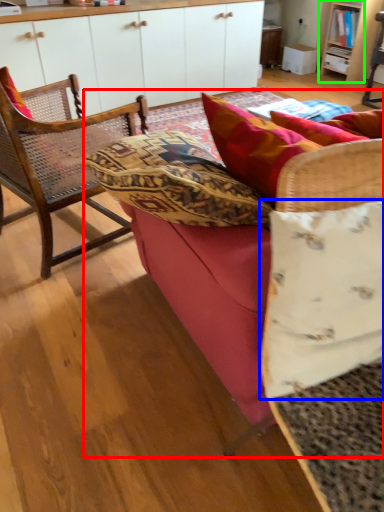
Question: Estimate the real-world distances between objects in this image. Which object is closer to studio couch (highlighted by a red box), pillow (highlighted by a blue box) or shelf (highlighted by a green box)?

Choices:
 (A) pillow
 (B) shelf

Answer: (A)